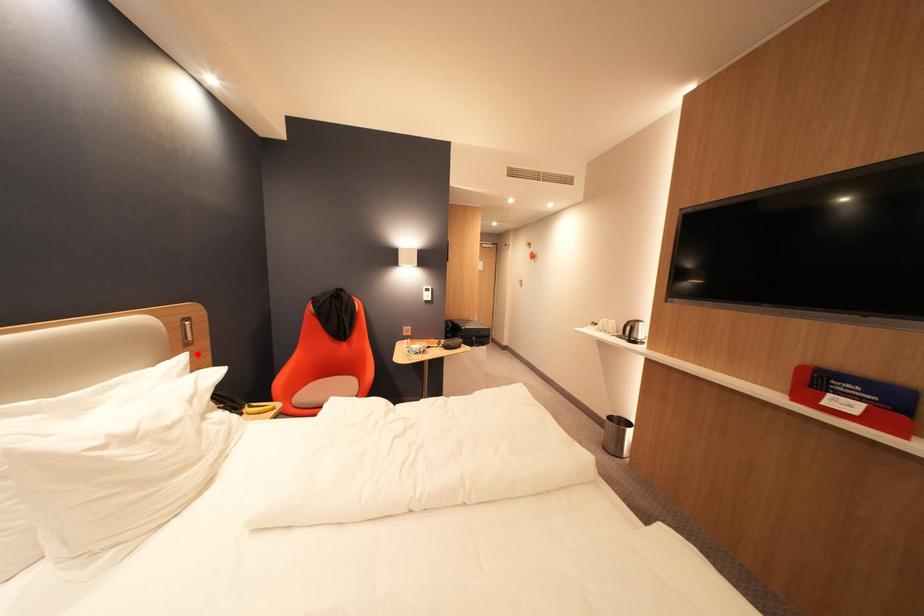
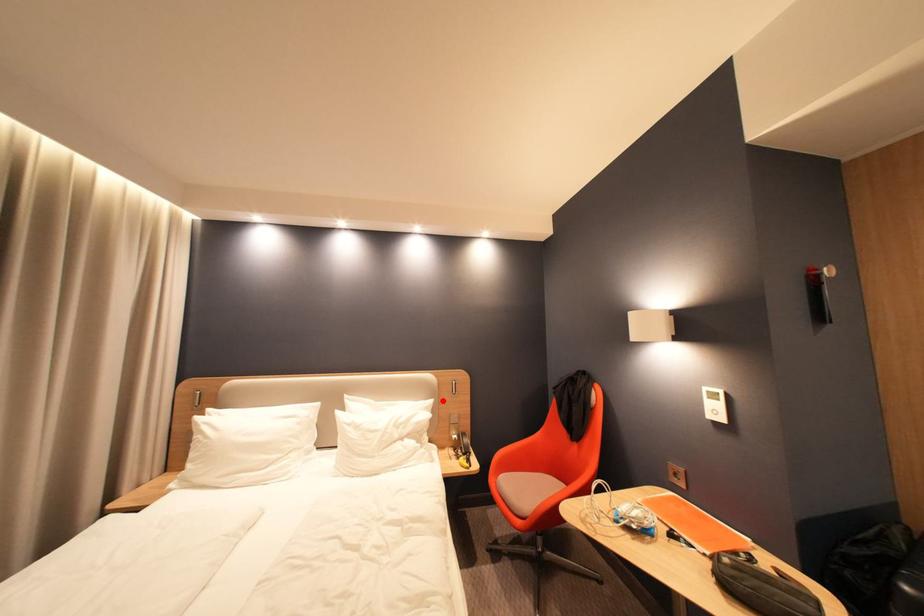
I am providing you with two images of the same scene from different viewpoints. A red point is marked on the first image and another point is marked on the second image. Is the marked point in image1 the same physical position as the marked point in image2?

Yes